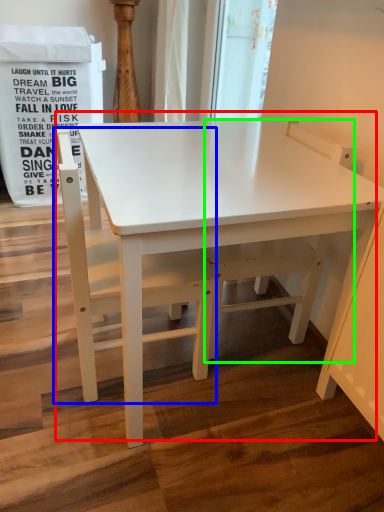
Question: Which object is the farthest from table (highlighted by a red box)? Choose among these: chair (highlighted by a blue box) or swivel chair (highlighted by a green box).

Choices:
 (A) chair
 (B) swivel chair

Answer: (B)